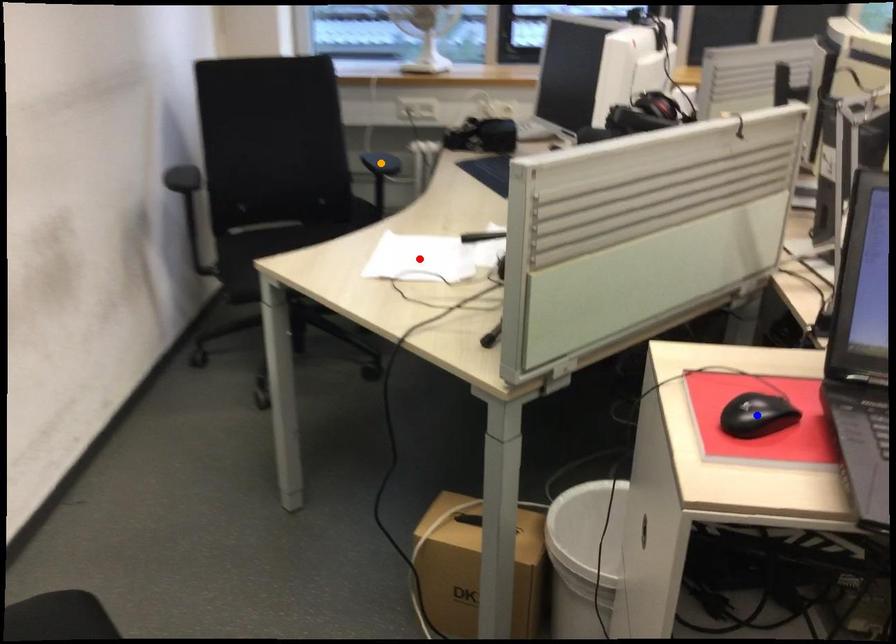
Order these from nearest to farthest:
1. orange point
2. blue point
3. red point

1. blue point
2. red point
3. orange point